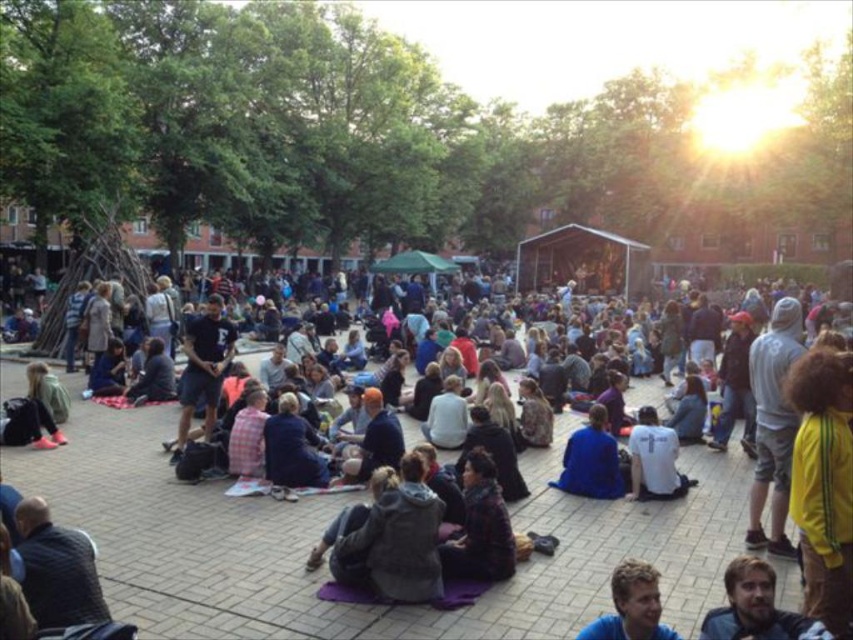
You are organizing a picnic and need to decide which item can accommodate more people. Based on the image, which between the dark blue denim shorts at center and the blue fabric at center is bigger in size?

The dark blue denim shorts at center has a larger size compared to blue fabric at center, so it can accommodate more people.